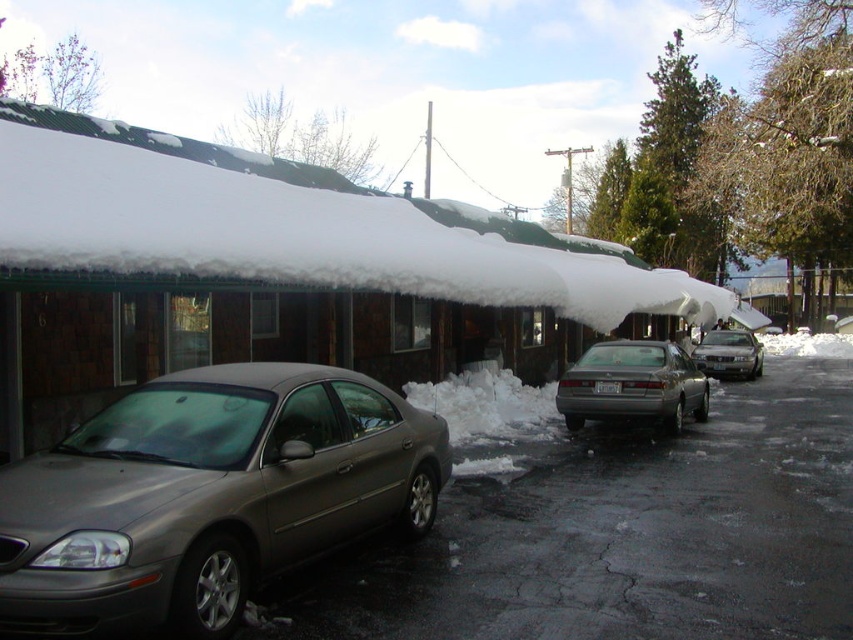
You are standing at the point with coordinates point (207, 496). Looking around, you see a satin metallic sedan at center. What object are you standing on?

The point (207, 496) corresponds to the satin metallic sedan at center, so you are standing on the satin metallic sedan at center.

You are a delivery person trying to park your van in the parking lot shown. You see the matte gray sedan at center and the silver metallic sedan at right. Which vehicle should you move to access the parking spot behind them?

The matte gray sedan at center is located above the silver metallic sedan at right, so you should move the matte gray sedan at center first to access the parking spot behind them.